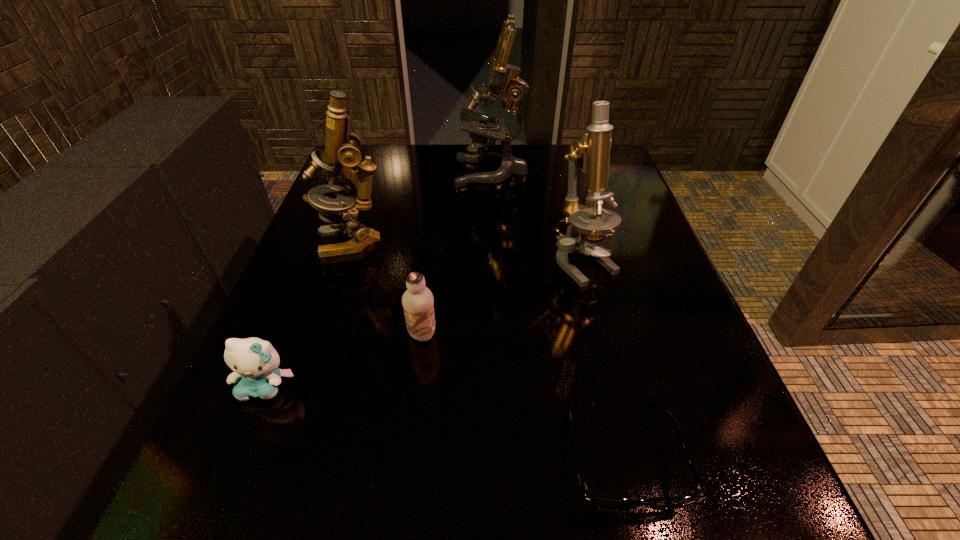
Identify which microscope is the second closest to the chocolate milk. Please provide its 2D coordinates. Your answer should be formatted as a tuple, i.e. [(x, y)], where the tuple contains the x and y coordinates of a point satisfying the conditions above.

[(585, 225)]

Locate which microscope ranks third in proximity to the spectacles. Please provide its 2D coordinates. Your answer should be formatted as a tuple, i.e. [(x, y)], where the tuple contains the x and y coordinates of a point satisfying the conditions above.

[(502, 77)]

Find the location of a particular element. The image size is (960, 540). free location that satisfies the following two spatial constraints: 1. at the eyepieces of the second microscope from right to left; 2. on the right side of the rightmost microscope is located at coordinates (494, 262).

Locate an element on the screen. vacant region that satisfies the following two spatial constraints: 1. at the eyepieces of the second microscope from right to left; 2. on the right side of the rightmost microscope is located at coordinates (494, 262).

You are a GUI agent. You are given a task and a screenshot of the screen. Output one action in this format:
    pyautogui.click(x=<x>, y=<y>)
    Task: Click on the vacant area in the image that satisfies the following two spatial constraints: 1. at the eyepieces of the farthest microscope; 2. on the front side of the leftmost microscope
    The image size is (960, 540).
    Given the screenshot: What is the action you would take?
    pyautogui.click(x=493, y=241)